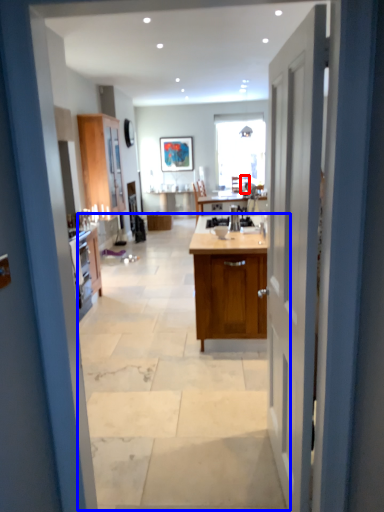
Question: Which of the following is the closest to the observer, chair (highlighted by a red box) or plain (highlighted by a blue box)?

Choices:
 (A) chair
 (B) plain

Answer: (B)